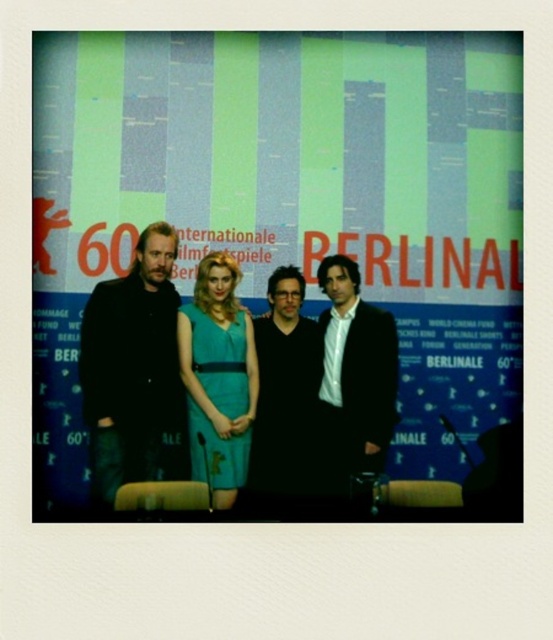
Question: Which object is farther from the camera taking this photo?

Choices:
 (A) white shirt at center
 (B) teal satin dress at center
 (C) matte black suit at left
 (D) black matte vest at center

Answer: (C)

Question: Does white shirt at center lie behind teal satin dress at center?

Choices:
 (A) no
 (B) yes

Answer: (A)

Question: Which of the following is the closest to the observer?

Choices:
 (A) black matte vest at center
 (B) white shirt at center
 (C) matte black suit at left
 (D) teal satin dress at center

Answer: (B)

Question: Is matte black suit at left bigger than teal satin dress at center?

Choices:
 (A) no
 (B) yes

Answer: (B)

Question: Is the position of matte black suit at left more distant than that of teal satin dress at center?

Choices:
 (A) no
 (B) yes

Answer: (B)

Question: Which object appears farthest from the camera in this image?

Choices:
 (A) white shirt at center
 (B) teal satin dress at center
 (C) matte black suit at left

Answer: (C)